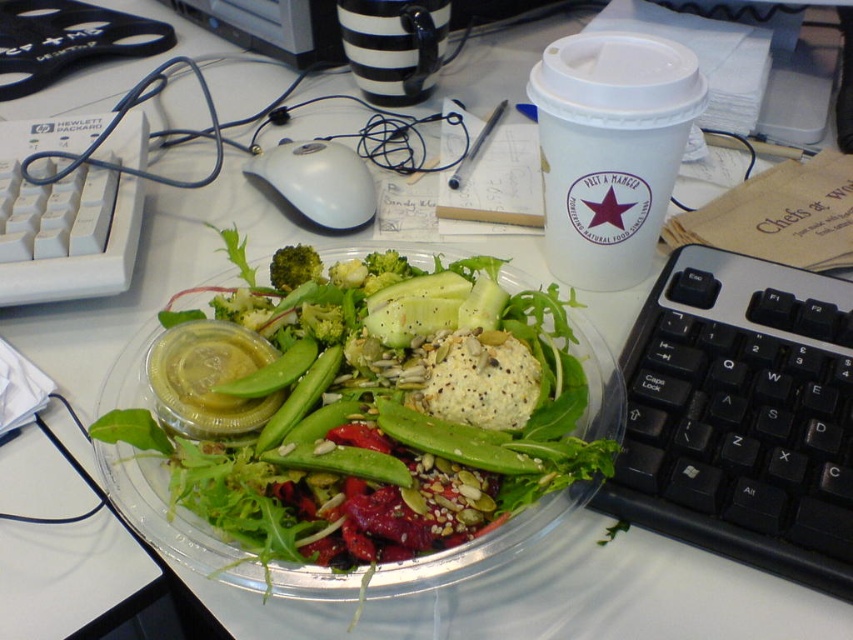
Question: Observing the image, what is the correct spatial positioning of translucent plastic salad at center in reference to black plastic keyboard at lower right?

Choices:
 (A) left
 (B) right

Answer: (A)

Question: Which of the following is the farthest from the observer?

Choices:
 (A) click(322, 307)
 (B) click(369, 208)
 (C) click(347, 566)
 (D) click(634, 477)

Answer: (B)

Question: Which object is closer to the camera taking this photo?

Choices:
 (A) translucent plastic salad at center
 (B) green matte broccoli at center
 (C) green broccoli at center
 (D) black plastic keyboard at lower right

Answer: (A)

Question: Which object appears closest to the camera in this image?

Choices:
 (A) black plastic keyboard at lower right
 (B) green leafy broccoli at center
 (C) green broccoli at center
 (D) green matte broccoli at center

Answer: (A)

Question: Is black plastic keyboard at lower right behind green broccoli at center?

Choices:
 (A) no
 (B) yes

Answer: (A)

Question: Does black plastic keyboard at lower right appear on the right side of green matte broccoli at center?

Choices:
 (A) no
 (B) yes

Answer: (B)